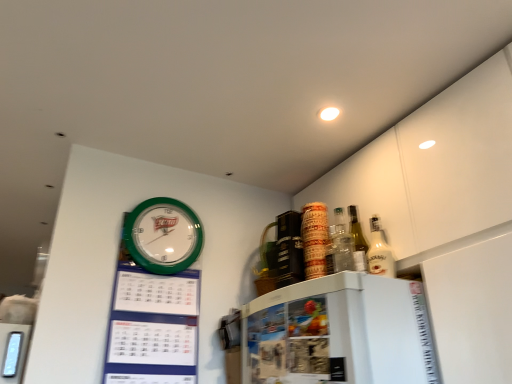
Question: From a real-world perspective, is green plastic calendar at upper left above or below white glossy bottle at upper right?

Choices:
 (A) below
 (B) above

Answer: (A)

Question: Is green plastic calendar at upper left to the left or to the right of white glossy bottle at upper right in the image?

Choices:
 (A) left
 (B) right

Answer: (A)

Question: Based on their relative distances, which object is farther from the white glossy bottle at upper right?

Choices:
 (A) green plastic calendar at upper left
 (B) green plastic wall clock at upper left

Answer: (A)

Question: Based on their relative distances, which object is nearer to the green plastic calendar at upper left?

Choices:
 (A) green plastic wall clock at upper left
 (B) white glossy bottle at upper right

Answer: (A)